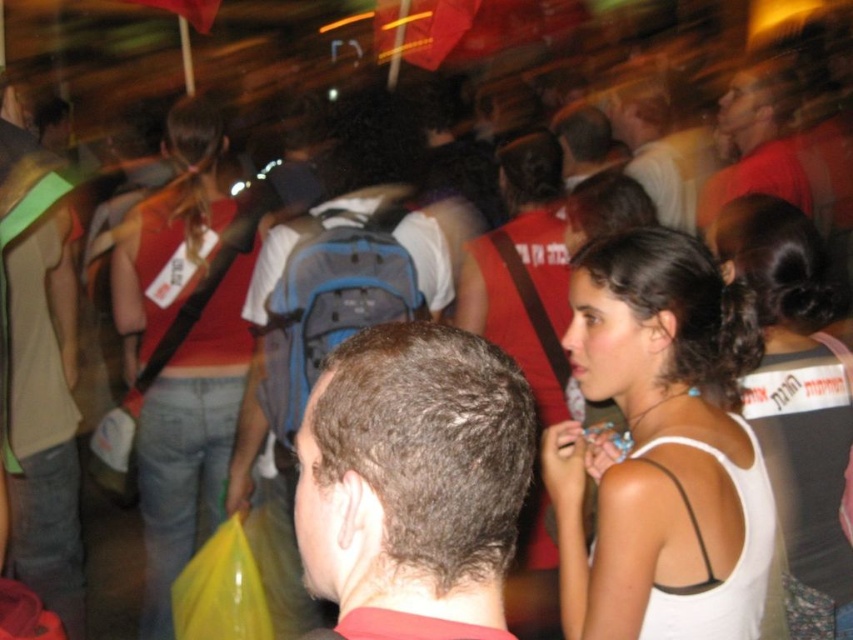
You are a photographer trying to capture a clear shot of the matte red shirt at upper right and the matte gray backpack at center. Since the background is out of focus, which object should you zoom in on to ensure both are in focus?

The matte red shirt at upper right is bigger than the matte gray backpack at center, so zooming in on the matte red shirt at upper right will ensure both are in focus because it is larger and closer to the camera.

In the scene shown: You are a photographer trying to capture a clear shot of both the white fabric tank top at center and the matte red shirt at upper right. Given their distance apart, can you adjust your camera settings to ensure both are in focus simultaneously?

The white fabric tank top at center is 7.97 feet away from the matte red shirt at upper right. To ensure both are in focus, adjust the camera aperture to a smaller opening, like f8 or higher, which increases depth of field, allowing both objects at different distances to be sharp.